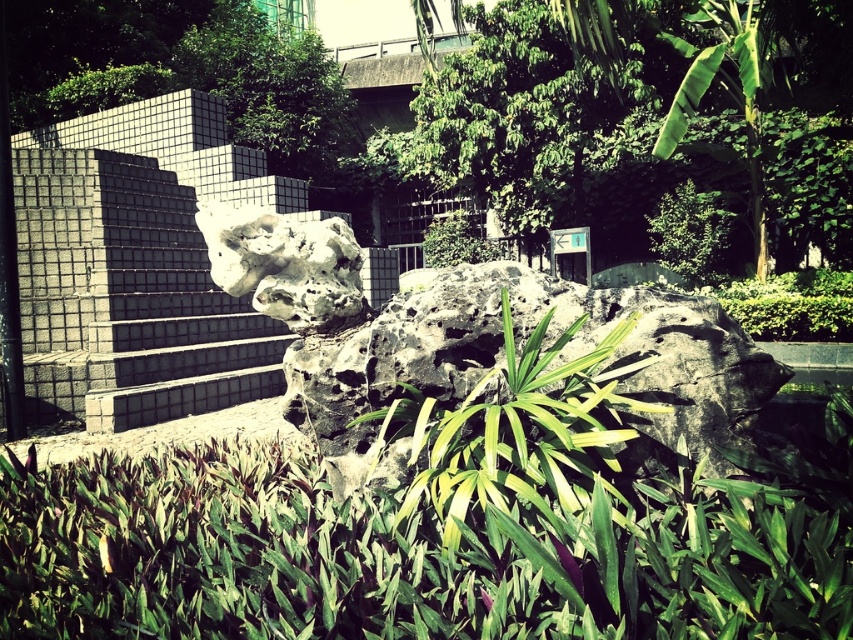
Is white stone sculpture at center to the left of green leafy bush at upper right from the viewer's perspective?

Yes, white stone sculpture at center is to the left of green leafy bush at upper right.

Can you confirm if white stone sculpture at center is positioned above green leafy bush at upper right?

Actually, white stone sculpture at center is below green leafy bush at upper right.

In order to click on white stone sculpture at center in this screenshot , I will do `click(474, 342)`.

Looking at this image, is white matte rock at center closer to the viewer compared to green leafy bush at upper left?

That is True.

Is white matte rock at center bigger than green leafy bush at upper left?

Incorrect, white matte rock at center is not larger than green leafy bush at upper left.

Image resolution: width=853 pixels, height=640 pixels. What do you see at coordinates (285, 266) in the screenshot? I see `white matte rock at center` at bounding box center [285, 266].

Identify the location of white matte rock at center. Image resolution: width=853 pixels, height=640 pixels. (285, 266).

Is white stone sculpture at center behind green leafy bush at upper left?

That is False.

Who is positioned more to the left, white stone sculpture at center or green leafy bush at upper left?

green leafy bush at upper left

Between point (486, 342) and point (39, 109), which one is positioned in front?

Point (486, 342) is in front.

Find the location of `white stone sculpture at center`. white stone sculpture at center is located at coordinates (474, 342).